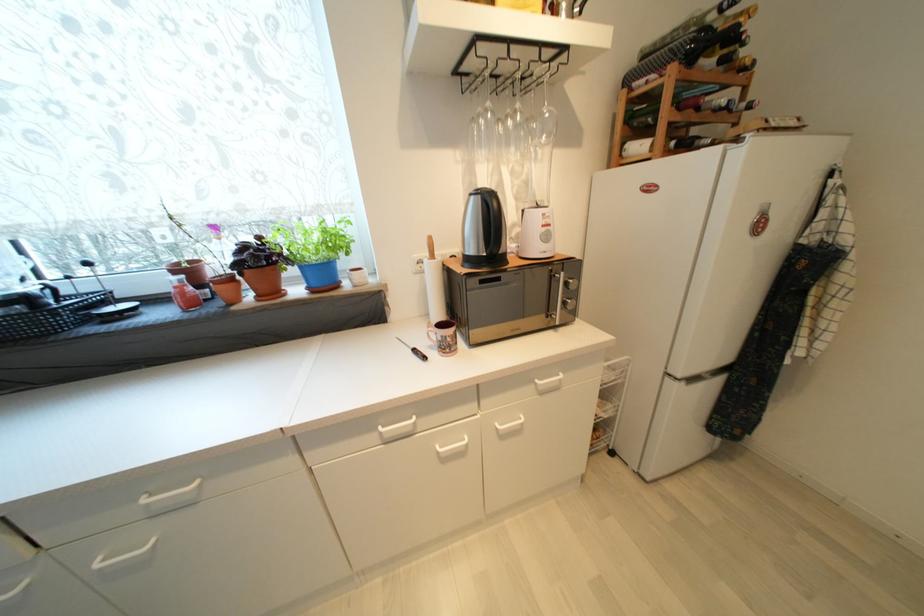
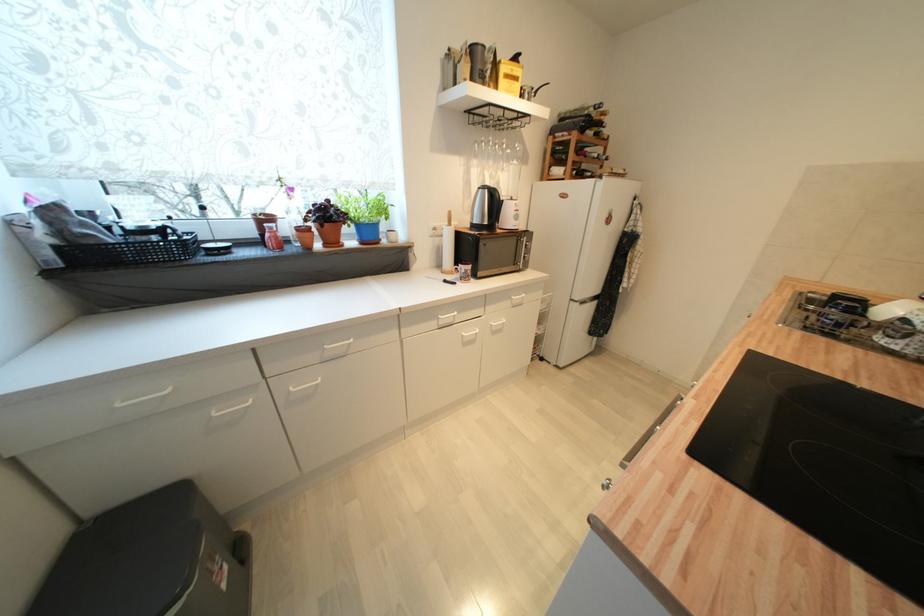
Find the pixel in the second image that matches (520,114) in the first image.

(507, 146)